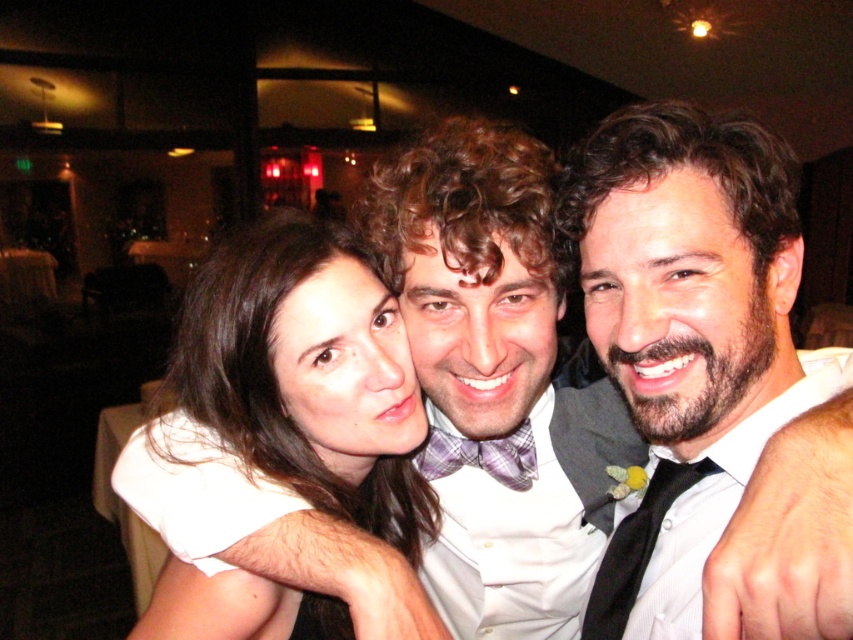
Is point (339, 458) more distant than point (618, 554)?

Yes, it is behind point (618, 554).

Does smooth white blouse at center appear under black satin tie at center?

No.

Is point (357, 346) positioned before point (657, 483)?

That is False.

You are a GUI agent. You are given a task and a screenshot of the screen. Output one action in this format:
    pyautogui.click(x=<x>, y=<y>)
    Task: Click on the smooth white blouse at center
    
    Given the screenshot: What is the action you would take?
    pyautogui.click(x=306, y=374)

Who is lower down, black satin bow tie at upper right or black satin tie at center?

black satin tie at center is below.

Is black satin bow tie at upper right behind black satin tie at center?

No, it is not.

Does point (627, 524) come closer to viewer compared to point (635, 566)?

No, it is not.

Locate an element on the screen. Image resolution: width=853 pixels, height=640 pixels. black satin bow tie at upper right is located at coordinates (682, 300).

Is white satin bow tie at center smaller than black satin tie at center?

No.

This screenshot has width=853, height=640. What are the coordinates of `white satin bow tie at center` in the screenshot? It's located at (790, 538).

Describe the element at coordinates (790, 538) in the screenshot. I see `white satin bow tie at center` at that location.

Locate an element on the screen. white satin bow tie at center is located at coordinates (790, 538).